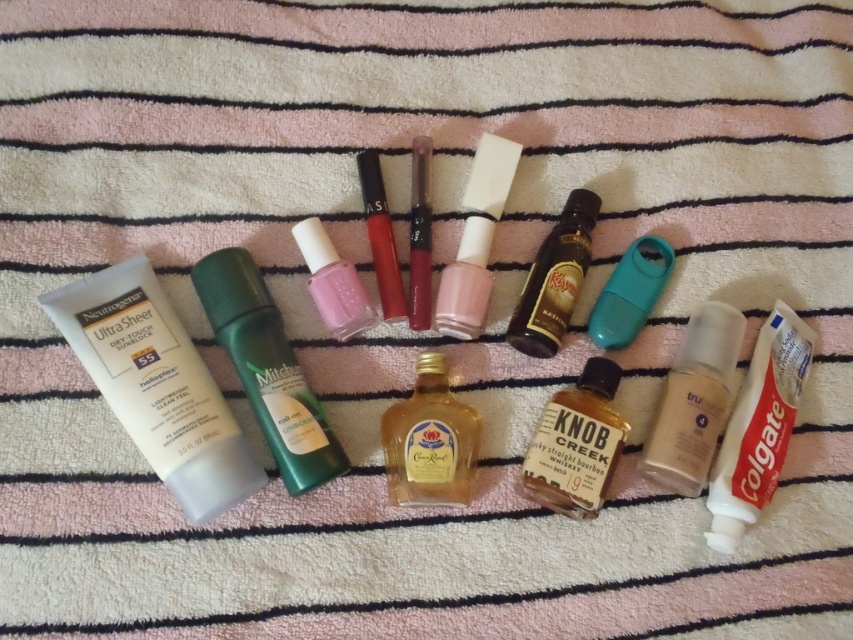
Can you confirm if matte pink nail polish at center is shorter than shiny metallic lipstick at center?

Yes.

Which is more to the left, matte pink nail polish at center or shiny metallic lipstick at center?

Positioned to the left is matte pink nail polish at center.

This screenshot has width=853, height=640. Describe the element at coordinates (334, 282) in the screenshot. I see `matte pink nail polish at center` at that location.

Where is `matte pink nail polish at center`? The image size is (853, 640). matte pink nail polish at center is located at coordinates (334, 282).

Locate an element on the screen. This screenshot has width=853, height=640. green matte lotion at center is located at coordinates (x=267, y=369).

Between green matte lotion at center and matte plastic nail polish at center, which one is positioned higher?

Positioned higher is matte plastic nail polish at center.

Who is more forward, (274, 378) or (506, 164)?

Point (274, 378)

I want to click on green matte lotion at center, so click(x=267, y=369).

The width and height of the screenshot is (853, 640). I want to click on green matte lotion at center, so click(x=267, y=369).

Looking at this image, who is positioned more to the right, green matte lotion at center or brown matte whiskey bottle at center?

From the viewer's perspective, brown matte whiskey bottle at center appears more on the right side.

Looking at this image, measure the distance between green matte lotion at center and camera.

A distance of 4.19 feet exists between green matte lotion at center and camera.

The width and height of the screenshot is (853, 640). Identify the location of green matte lotion at center. (267, 369).